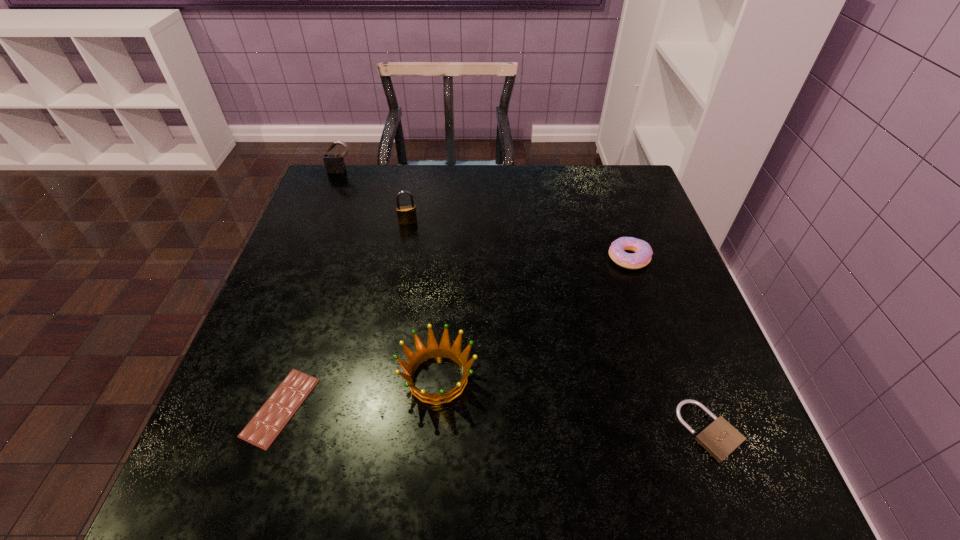
The height and width of the screenshot is (540, 960). Find the location of `free spot between the leftmost padlock and the second farthest padlock`. free spot between the leftmost padlock and the second farthest padlock is located at coordinates (374, 197).

The image size is (960, 540). Find the location of `free space between the second shortest object and the second padlock from right to left`. free space between the second shortest object and the second padlock from right to left is located at coordinates (559, 327).

Point out which object is positioned as the second nearest to the rightmost padlock. Please provide its 2D coordinates. Your answer should be formatted as a tuple, i.e. [(x, y)], where the tuple contains the x and y coordinates of a point satisfying the conditions above.

[(433, 349)]

Select which object is the third closest to the farthest object. Please provide its 2D coordinates. Your answer should be formatted as a tuple, i.e. [(x, y)], where the tuple contains the x and y coordinates of a point satisfying the conditions above.

[(265, 426)]

At what (x,y) coordinates should I click in order to perform the action: click on padlock that is the second closest to the nearest padlock. Please return your answer as a coordinate pair (x, y). The height and width of the screenshot is (540, 960). Looking at the image, I should click on pyautogui.click(x=334, y=163).

Where is `the second closest padlock to the crown`? the second closest padlock to the crown is located at coordinates (407, 214).

Where is `vacant space that satisfies the following two spatial constraints: 1. on the front side of the chocolate bar; 2. on the left side of the rightmost padlock`? vacant space that satisfies the following two spatial constraints: 1. on the front side of the chocolate bar; 2. on the left side of the rightmost padlock is located at coordinates (273, 431).

Locate an element on the screen. free point that satisfies the following two spatial constraints: 1. with the keyhole on the front of the farthest object; 2. on the left side of the fourth object from right to left is located at coordinates (321, 222).

The height and width of the screenshot is (540, 960). What are the coordinates of `free spot that satisfies the following two spatial constraints: 1. with the keyhole on the front of the farthest object; 2. on the left side of the second farthest object` in the screenshot? It's located at (321, 222).